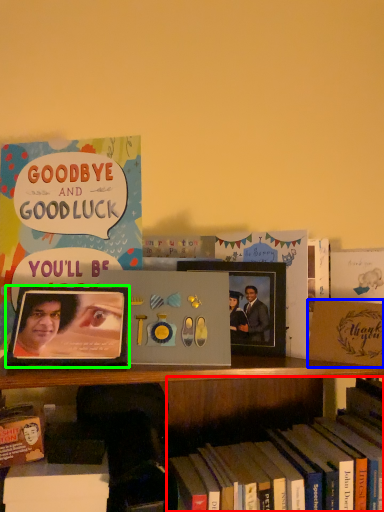
Question: Which object is the farthest from book (highlighted by a red box)? Choose among these: paperback book (highlighted by a blue box) or picture frame (highlighted by a green box).

Choices:
 (A) paperback book
 (B) picture frame

Answer: (B)